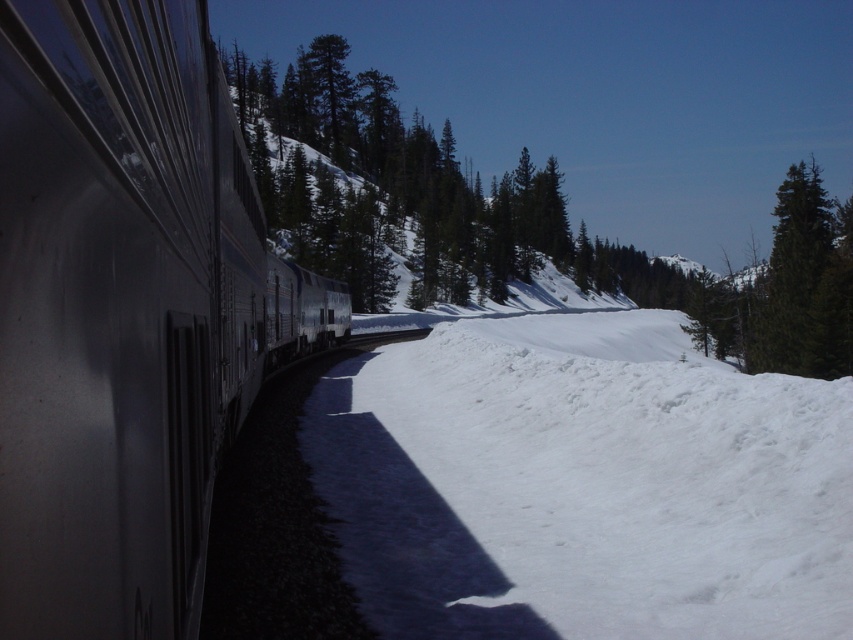
You are a photographer standing at the center of the train tracks, facing the direction the train is moving. You want to take a photo that includes both the metallic silver train at left and the green matte tree at upper right. Given that the distance between them is 163.73 feet, will the camera lens you have, which has a maximum field of view of 120 degrees, be able to capture both objects in a single frame?

The metallic silver train at left and green matte tree at upper right are 163.73 feet apart. Since the camera lens has a maximum field of view of 120 degrees, it can capture objects up to 163.73 feet apart within that angle. Therefore, the lens should be able to include both objects in a single frame.

Based on the photo, you are standing in the winter scene and want to reach the two points marked in the image. Which point, point (424, 536) or point (782, 333), will you reach first if you walk straight towards them?

Point (424, 536) is closer to the viewer than point (782, 333), so you will reach point (424, 536) first.